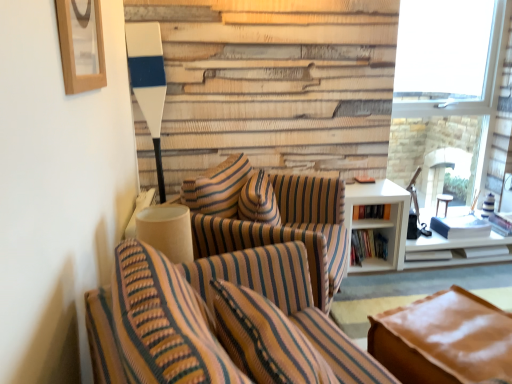
Question: Is point (276, 231) closer or farther from the camera than point (356, 235)?

Choices:
 (A) closer
 (B) farther

Answer: (A)

Question: Is striped fabric chair at center, marked as the 2th chair in a front-to-back arrangement, wider or thinner than hardcover books at right, which is the second book from top to bottom?

Choices:
 (A) thin
 (B) wide

Answer: (B)

Question: Which is nearer to the wooden picture frame at upper left?

Choices:
 (A) wooden table at right
 (B) white matte table lamp at left
 (C) hardcover books at right, which is the second book from bottom to top
 (D) hardcover books at right, the first book when ordered from bottom to top
 (E) white matte window at upper right

Answer: (B)

Question: Which object is positioned closest to the hardcover books at right, which is the second book from bottom to top?

Choices:
 (A) white matte table lamp at left
 (B) wooden picture frame at upper left
 (C) brown leather couch at lower right
 (D) hardcover books at right, which is the second book from top to bottom
 (E) striped fabric chair at center, marked as the 2th chair in a front-to-back arrangement

Answer: (D)